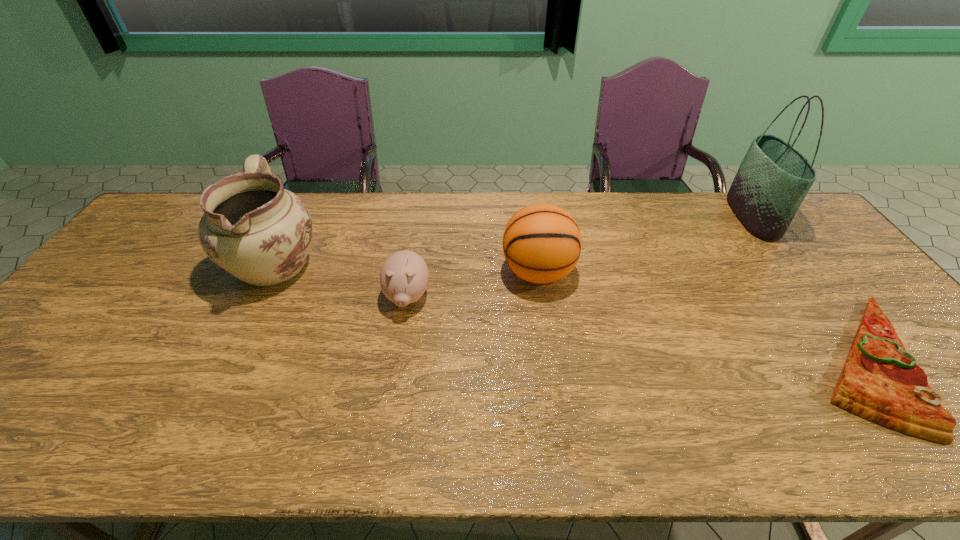
Identify the location of free space located at the snout of the second shortest object. This screenshot has height=540, width=960. (391, 395).

Find the location of `tote bag at the far edge`. tote bag at the far edge is located at coordinates (774, 177).

Image resolution: width=960 pixels, height=540 pixels. In order to click on pitcher present at the far edge in this screenshot , I will do `click(254, 229)`.

This screenshot has height=540, width=960. What are the coordinates of `object that is at the right edge` in the screenshot? It's located at (774, 177).

This screenshot has height=540, width=960. I want to click on object that is positioned at the far right corner, so click(x=774, y=177).

Find the location of `vacant area at the far edge of the desktop`. vacant area at the far edge of the desktop is located at coordinates (397, 218).

At what (x,y) coordinates should I click in order to perform the action: click on free location at the near edge. Please return your answer as a coordinate pair (x, y). The width and height of the screenshot is (960, 540). Looking at the image, I should click on (417, 436).

Find the location of a particular element. This screenshot has height=540, width=960. vacant space at the left edge of the desktop is located at coordinates (120, 312).

The height and width of the screenshot is (540, 960). Identify the location of free space at the far left corner of the desktop. (188, 225).

You are a GUI agent. You are given a task and a screenshot of the screen. Output one action in this format:
    pyautogui.click(x=<x>, y=<y>)
    Task: Click on the free space at the near left corner of the desktop
    The height and width of the screenshot is (540, 960).
    Given the screenshot: What is the action you would take?
    pyautogui.click(x=9, y=427)